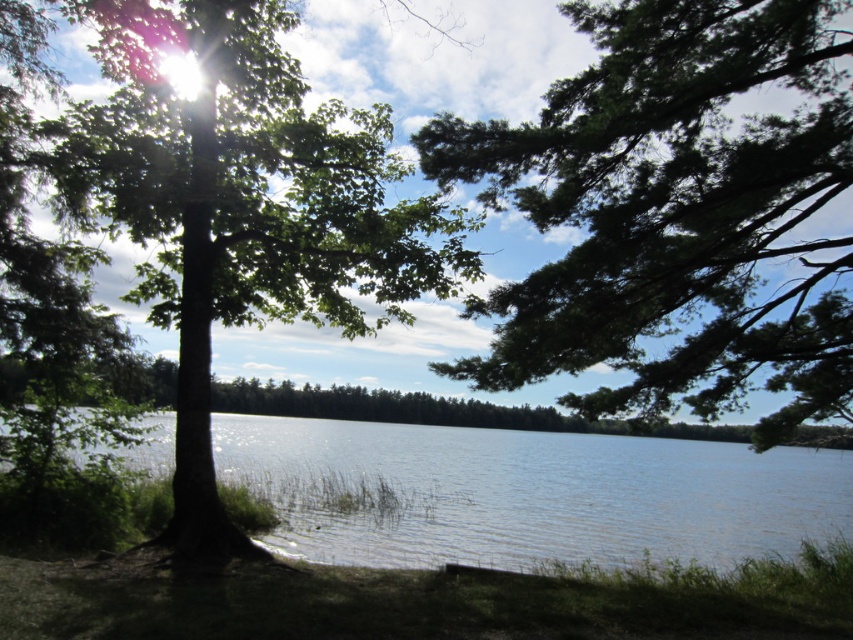
You are standing at the lakeside and want to take a photo of the green leafy tree at left. If your camera has a maximum zoom range of 30 feet, will you need to move closer to the tree to capture it clearly?

The green leafy tree at left is 40.12 feet away from you, which exceeds the camera maximum zoom range of 30 feet. Therefore, you need to move closer to the tree to capture it clearly.

You are standing at the lakeside and want to take a photo of the clear water at center without the green leafy tree at left blocking the view. Which direction should you move to ensure the tree is no longer in the frame?

To avoid the green leafy tree at left blocking the view of the clear water at center, you should move to the right side of the scene. This will position the tree to the left of your frame while keeping the clear water at center in focus.

You are standing at the point marked by the coordinates point (241, 205) in the image. Looking around, you see a green leafy tree at left. Which direction should you face to see the dense line of trees in the background?

The dense line of trees in the background is located behind you when facing the green leafy tree at left. So, you should turn around to face the opposite direction to see the dense line of trees in the background.